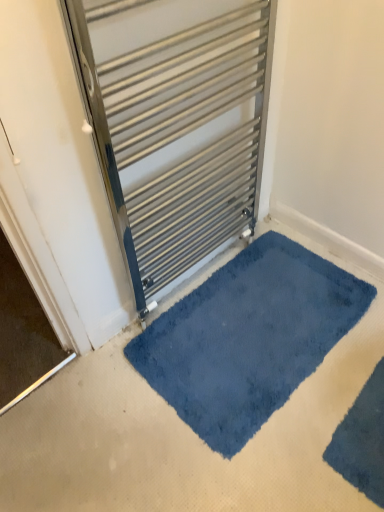
This screenshot has height=512, width=384. Find the location of `velvety blue bath mat at lower right, positioned as the 2th bath mat in back-to-front order`. velvety blue bath mat at lower right, positioned as the 2th bath mat in back-to-front order is located at coordinates point(362,440).

Is the surface of velvety blue bath mat at lower right, positioned as the 2th bath mat in back-to-front order, in direct contact with metallic silver radiator at center?

velvety blue bath mat at lower right, positioned as the 2th bath mat in back-to-front order, and metallic silver radiator at center are not in contact.

Does velvety blue bath mat at lower right, which is the 1th bath mat from front to back, come behind metallic silver radiator at center?

Yes, velvety blue bath mat at lower right, which is the 1th bath mat from front to back, is further from the viewer.

Which point is more distant from viewer, (367, 436) or (156, 55)?

Positioned behind is point (367, 436).

Is metallic silver radiator at center wider or thinner than velvety blue bath mat at lower right, which is the 1th bath mat from front to back?

Considering their sizes, metallic silver radiator at center looks slimmer than velvety blue bath mat at lower right, which is the 1th bath mat from front to back.

Does metallic silver radiator at center have a smaller size compared to velvety blue bath mat at lower right, which is the 1th bath mat from front to back?

Incorrect, metallic silver radiator at center is not smaller in size than velvety blue bath mat at lower right, which is the 1th bath mat from front to back.

Is velvety blue bath mat at lower right, which is the 1th bath mat from front to back, at the back of metallic silver radiator at center?

No, velvety blue bath mat at lower right, which is the 1th bath mat from front to back, is not at the back of metallic silver radiator at center.

The image size is (384, 512). Identify the location of door that appears above the velvety blue bath mat at lower right, which is the 1th bath mat from front to back (from a real-world perspective). (176, 123).

Is velvety blue bath mat at lower right, positioned as the 2th bath mat in back-to-front order, wider or thinner than blue plush bath mat at center, which ranks as the second bath mat in front-to-back order?

Clearly, velvety blue bath mat at lower right, positioned as the 2th bath mat in back-to-front order, has less width compared to blue plush bath mat at center, which ranks as the second bath mat in front-to-back order.

Is velvety blue bath mat at lower right, positioned as the 2th bath mat in back-to-front order, turned away from blue plush bath mat at center, which ranks as the second bath mat in front-to-back order?

velvety blue bath mat at lower right, positioned as the 2th bath mat in back-to-front order, is not turned away from blue plush bath mat at center, which ranks as the second bath mat in front-to-back order.

I want to click on bath mat located behind the velvety blue bath mat at lower right, positioned as the 2th bath mat in back-to-front order, so click(x=248, y=338).

Looking at this image, considering the sizes of objects blue plush bath mat at center, which ranks as the second bath mat in front-to-back order, and velvety blue bath mat at lower right, which is the 1th bath mat from front to back, in the image provided, who is taller, blue plush bath mat at center, which ranks as the second bath mat in front-to-back order, or velvety blue bath mat at lower right, which is the 1th bath mat from front to back,?

With more height is velvety blue bath mat at lower right, which is the 1th bath mat from front to back.

From the picture: Is blue plush bath mat at center, which appears as the 1th bath mat when viewed from the back, inside the boundaries of velvety blue bath mat at lower right, positioned as the 2th bath mat in back-to-front order, or outside?

blue plush bath mat at center, which appears as the 1th bath mat when viewed from the back, is not enclosed by velvety blue bath mat at lower right, positioned as the 2th bath mat in back-to-front order.

Is velvety blue bath mat at lower right, positioned as the 2th bath mat in back-to-front order, at the back of blue plush bath mat at center, which appears as the 1th bath mat when viewed from the back?

Absolutely, blue plush bath mat at center, which appears as the 1th bath mat when viewed from the back, is directed away from velvety blue bath mat at lower right, positioned as the 2th bath mat in back-to-front order.

I want to click on bath mat above the velvety blue bath mat at lower right, positioned as the 2th bath mat in back-to-front order (from a real-world perspective), so click(x=248, y=338).

From the picture: How many degrees apart are the facing directions of blue plush bath mat at center, which ranks as the second bath mat in front-to-back order, and metallic silver radiator at center?

The facing directions of blue plush bath mat at center, which ranks as the second bath mat in front-to-back order, and metallic silver radiator at center are 180 degrees apart.

Is blue plush bath mat at center, which ranks as the second bath mat in front-to-back order, wider than metallic silver radiator at center?

Yes.

Consider the image. Is metallic silver radiator at center surrounded by blue plush bath mat at center, which appears as the 1th bath mat when viewed from the back?

Actually, metallic silver radiator at center is outside blue plush bath mat at center, which appears as the 1th bath mat when viewed from the back.

Can you confirm if blue plush bath mat at center, which appears as the 1th bath mat when viewed from the back, is taller than metallic silver radiator at center?

Incorrect, the height of blue plush bath mat at center, which appears as the 1th bath mat when viewed from the back, is not larger of that of metallic silver radiator at center.

Is metallic silver radiator at center further to the viewer compared to blue plush bath mat at center, which ranks as the second bath mat in front-to-back order?

No, it is in front of blue plush bath mat at center, which ranks as the second bath mat in front-to-back order.

Find the location of a particular element. This screenshot has height=512, width=384. door above the blue plush bath mat at center, which ranks as the second bath mat in front-to-back order (from a real-world perspective) is located at coordinates (176, 123).

Does metallic silver radiator at center have a larger size compared to blue plush bath mat at center, which ranks as the second bath mat in front-to-back order?

Indeed, metallic silver radiator at center has a larger size compared to blue plush bath mat at center, which ranks as the second bath mat in front-to-back order.

Is metallic silver radiator at center not close to blue plush bath mat at center, which appears as the 1th bath mat when viewed from the back?

No, metallic silver radiator at center is in close proximity to blue plush bath mat at center, which appears as the 1th bath mat when viewed from the back.

In order to click on door above the velvety blue bath mat at lower right, positioned as the 2th bath mat in back-to-front order (from a real-world perspective) in this screenshot , I will do `click(176, 123)`.

There is a metallic silver radiator at center. Where is `the 2nd bath mat below it (from the image's perspective)`? Image resolution: width=384 pixels, height=512 pixels. the 2nd bath mat below it (from the image's perspective) is located at coordinates (362, 440).

Which object lies further to the anchor point metallic silver radiator at center, velvety blue bath mat at lower right, positioned as the 2th bath mat in back-to-front order, or blue plush bath mat at center, which ranks as the second bath mat in front-to-back order?

velvety blue bath mat at lower right, positioned as the 2th bath mat in back-to-front order, is positioned further to the anchor metallic silver radiator at center.

When comparing their distances from blue plush bath mat at center, which ranks as the second bath mat in front-to-back order, does metallic silver radiator at center or velvety blue bath mat at lower right, positioned as the 2th bath mat in back-to-front order, seem further?

metallic silver radiator at center is further to blue plush bath mat at center, which ranks as the second bath mat in front-to-back order.

Which object lies nearer to the anchor point velvety blue bath mat at lower right, which is the 1th bath mat from front to back, blue plush bath mat at center, which ranks as the second bath mat in front-to-back order, or metallic silver radiator at center?

→ blue plush bath mat at center, which ranks as the second bath mat in front-to-back order, lies closer to velvety blue bath mat at lower right, which is the 1th bath mat from front to back, than the other object.

From the image, which object appears to be nearer to metallic silver radiator at center, blue plush bath mat at center, which ranks as the second bath mat in front-to-back order, or velvety blue bath mat at lower right, which is the 1th bath mat from front to back?

blue plush bath mat at center, which ranks as the second bath mat in front-to-back order, is closer to metallic silver radiator at center.

Which object lies further to the anchor point velvety blue bath mat at lower right, positioned as the 2th bath mat in back-to-front order, metallic silver radiator at center or blue plush bath mat at center, which appears as the 1th bath mat when viewed from the back?

metallic silver radiator at center.

Looking at the image, which one is located closer to blue plush bath mat at center, which ranks as the second bath mat in front-to-back order, velvety blue bath mat at lower right, which is the 1th bath mat from front to back, or metallic silver radiator at center?

velvety blue bath mat at lower right, which is the 1th bath mat from front to back, is closer to blue plush bath mat at center, which ranks as the second bath mat in front-to-back order.

You are a GUI agent. You are given a task and a screenshot of the screen. Output one action in this format:
    pyautogui.click(x=<x>, y=<y>)
    Task: Click on the bath mat that lies between metallic silver radiator at center and velvety blue bath mat at lower right, positioned as the 2th bath mat in back-to-front order, from top to bottom
    Image resolution: width=384 pixels, height=512 pixels.
    Given the screenshot: What is the action you would take?
    pyautogui.click(x=248, y=338)